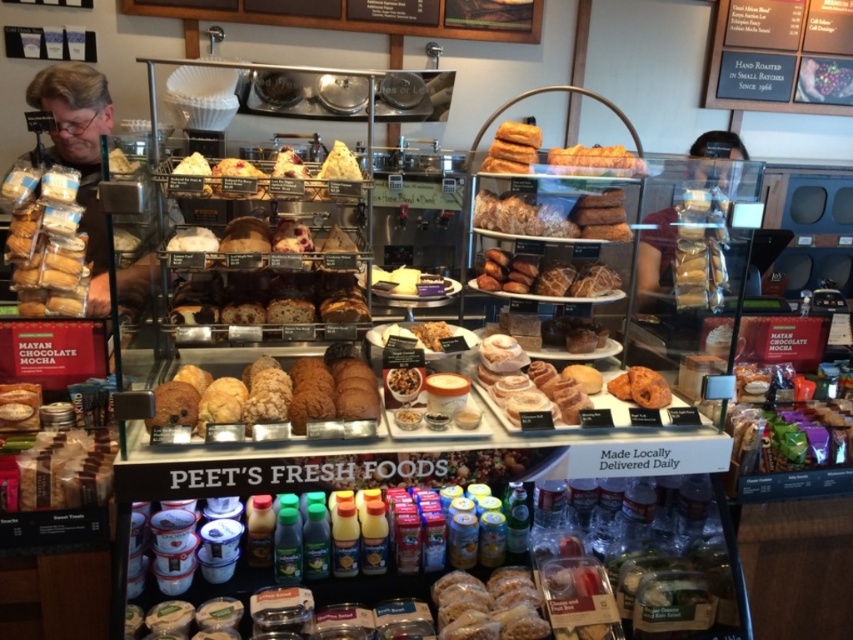
Question: Which is farther from the translucent plastic baguette at center?

Choices:
 (A) golden brown flaky pastry at upper center
 (B) golden brown crumbly pastries at center
 (C) matte brown pastries at left

Answer: (C)

Question: Is golden brown crumbly pastries at center positioned at the back of translucent plastic baguette at center?

Choices:
 (A) yes
 (B) no

Answer: (B)

Question: Which point is farther to the camera?

Choices:
 (A) golden brown flaky pastry at upper center
 (B) golden brown crumbly pastries at center

Answer: (A)

Question: Which point is closer to the camera?

Choices:
 (A) matte brown bagel at lower left
 (B) matte brown pastries at left
 (C) golden brown flaky pastry at upper center

Answer: (A)

Question: Does translucent plastic baguette at center appear under golden brown flaky pastry at upper center?

Choices:
 (A) no
 (B) yes

Answer: (B)

Question: Does matte brown pastries at left appear under matte brown bagel at lower left?

Choices:
 (A) yes
 (B) no

Answer: (B)